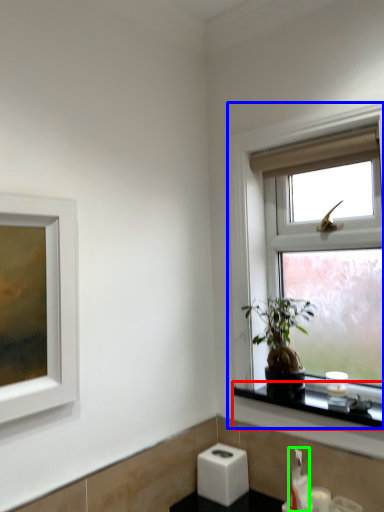
Question: Which object is positioned farthest from window sill (highlighted by a red box)? Select from window (highlighted by a blue box) and soap dispenser (highlighted by a green box).

Choices:
 (A) window
 (B) soap dispenser

Answer: (A)